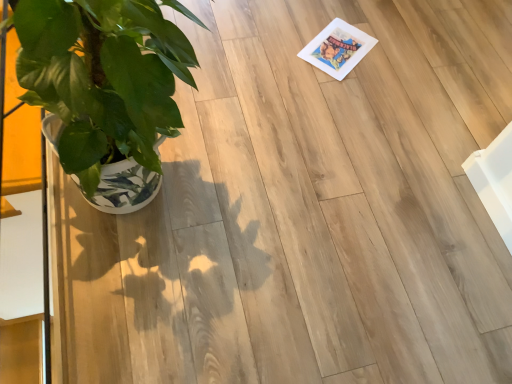
Locate an element on the screen. The height and width of the screenshot is (384, 512). vacant area located to the right-hand side of green glossy plant at left is located at coordinates (274, 202).